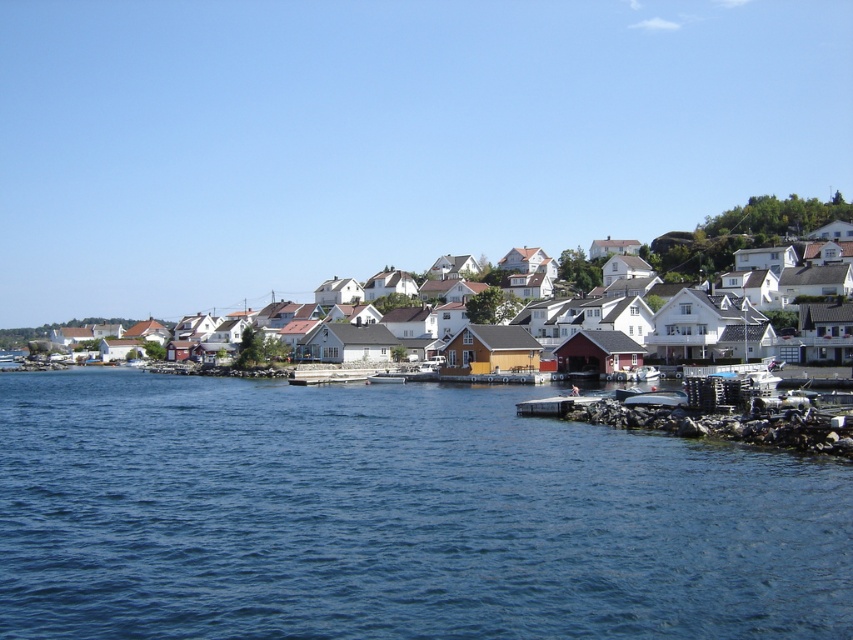
Question: Can you confirm if smooth concrete dock at lower center is thinner than metallic gray boat at lower right?

Choices:
 (A) no
 (B) yes

Answer: (A)

Question: Which object appears farthest from the camera in this image?

Choices:
 (A) metallic gray boat at lower right
 (B) blue water at lower center
 (C) white wooden houses at center

Answer: (C)

Question: Which point is closer to the camera?

Choices:
 (A) white wooden houses at center
 (B) metallic gray boat at lower right

Answer: (B)

Question: Is blue water at lower center positioned in front of metallic gray boat at lower right?

Choices:
 (A) no
 (B) yes

Answer: (B)

Question: Which object is positioned closest to the white wooden houses at center?

Choices:
 (A) metallic gray boat at lower right
 (B) smooth concrete dock at lower center
 (C) blue water at lower center

Answer: (C)

Question: Is blue water at lower center thinner than smooth concrete dock at lower center?

Choices:
 (A) yes
 (B) no

Answer: (B)